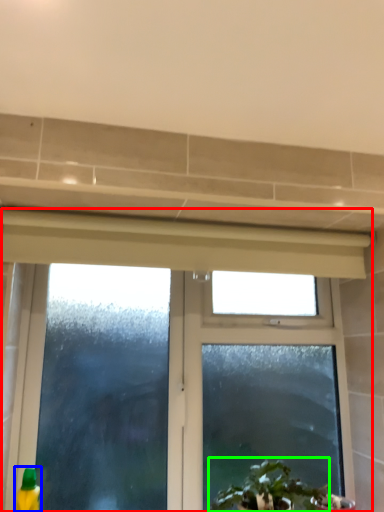
Question: Considering the real-world distances, which object is farthest from window (highlighted by a red box)? cleaning product (highlighted by a blue box) or houseplant (highlighted by a green box)?

Choices:
 (A) cleaning product
 (B) houseplant

Answer: (A)